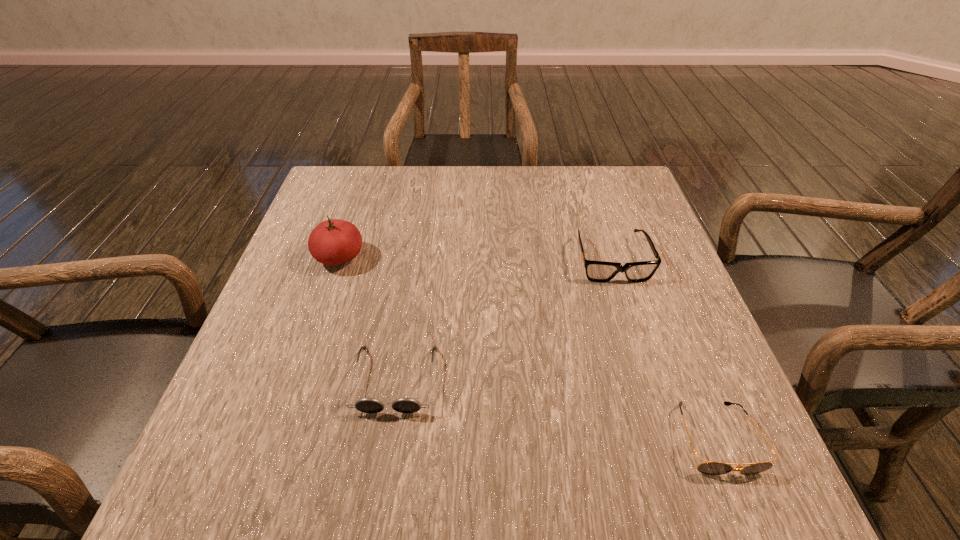
Identify the location of object present at the near right corner. The image size is (960, 540). [x=709, y=468].

Find the location of a particular element. This screenshot has width=960, height=540. free region at the far edge is located at coordinates (417, 172).

In the image, there is a desktop. At what (x,y) coordinates should I click in order to perform the action: click on vacant area at the near edge. Please return your answer as a coordinate pair (x, y). The height and width of the screenshot is (540, 960). Looking at the image, I should click on (424, 484).

The height and width of the screenshot is (540, 960). In the image, there is a desktop. Find the location of `vacant space at the left edge`. vacant space at the left edge is located at coordinates (293, 307).

This screenshot has height=540, width=960. Find the location of `free space at the right edge of the desktop`. free space at the right edge of the desktop is located at coordinates (671, 256).

You are a GUI agent. You are given a task and a screenshot of the screen. Output one action in this format:
    pyautogui.click(x=<x>, y=<y>)
    Task: Click on the vacant space at the far left corner
    This screenshot has height=540, width=960.
    Given the screenshot: What is the action you would take?
    pyautogui.click(x=377, y=171)

Locate an element on the screen. vacant position at the near left corner of the desktop is located at coordinates (281, 498).

Find the location of `vacant region at the far right corner of the desktop`. vacant region at the far right corner of the desktop is located at coordinates (589, 171).

You are a GUI agent. You are given a task and a screenshot of the screen. Output one action in this format:
    pyautogui.click(x=<x>, y=<y>)
    Task: Click on the free space between the tallest sunglasses and the second object from left to right
    This screenshot has height=540, width=960.
    Given the screenshot: What is the action you would take?
    pyautogui.click(x=503, y=320)

Find the location of a particular element. The width and height of the screenshot is (960, 540). vacant space in between the tallest object and the second object from left to right is located at coordinates (368, 318).